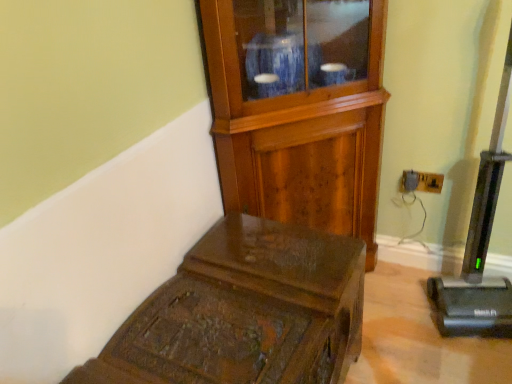
Question: Should I look upward or downward to see wooden trunk at lower left?

Choices:
 (A) down
 (B) up

Answer: (A)

Question: Is black plastic vacuum cleaner at right outside wooden side cabinet at center?

Choices:
 (A) yes
 (B) no

Answer: (A)

Question: From a real-world perspective, is black plastic vacuum cleaner at right positioned under wooden side cabinet at center based on gravity?

Choices:
 (A) no
 (B) yes

Answer: (B)

Question: Is black plastic vacuum cleaner at right surrounding wooden side cabinet at center?

Choices:
 (A) no
 (B) yes

Answer: (A)

Question: Is black plastic vacuum cleaner at right in front of wooden side cabinet at center?

Choices:
 (A) yes
 (B) no

Answer: (A)

Question: Can you confirm if black plastic vacuum cleaner at right is thinner than wooden side cabinet at center?

Choices:
 (A) yes
 (B) no

Answer: (A)

Question: Considering the relative sizes of black plastic vacuum cleaner at right and wooden side cabinet at center in the image provided, is black plastic vacuum cleaner at right bigger than wooden side cabinet at center?

Choices:
 (A) yes
 (B) no

Answer: (B)

Question: Is wooden trunk at lower left smaller than wooden side cabinet at center?

Choices:
 (A) no
 (B) yes

Answer: (B)

Question: Is wooden trunk at lower left not within wooden side cabinet at center?

Choices:
 (A) no
 (B) yes

Answer: (B)

Question: From the image's perspective, is wooden trunk at lower left above wooden side cabinet at center?

Choices:
 (A) yes
 (B) no

Answer: (B)

Question: Can you confirm if wooden trunk at lower left is taller than wooden side cabinet at center?

Choices:
 (A) yes
 (B) no

Answer: (B)

Question: Does wooden trunk at lower left have a larger size compared to wooden side cabinet at center?

Choices:
 (A) no
 (B) yes

Answer: (A)

Question: Is wooden trunk at lower left shorter than wooden side cabinet at center?

Choices:
 (A) yes
 (B) no

Answer: (A)

Question: Is wooden side cabinet at center shorter than black plastic vacuum cleaner at right?

Choices:
 (A) no
 (B) yes

Answer: (B)